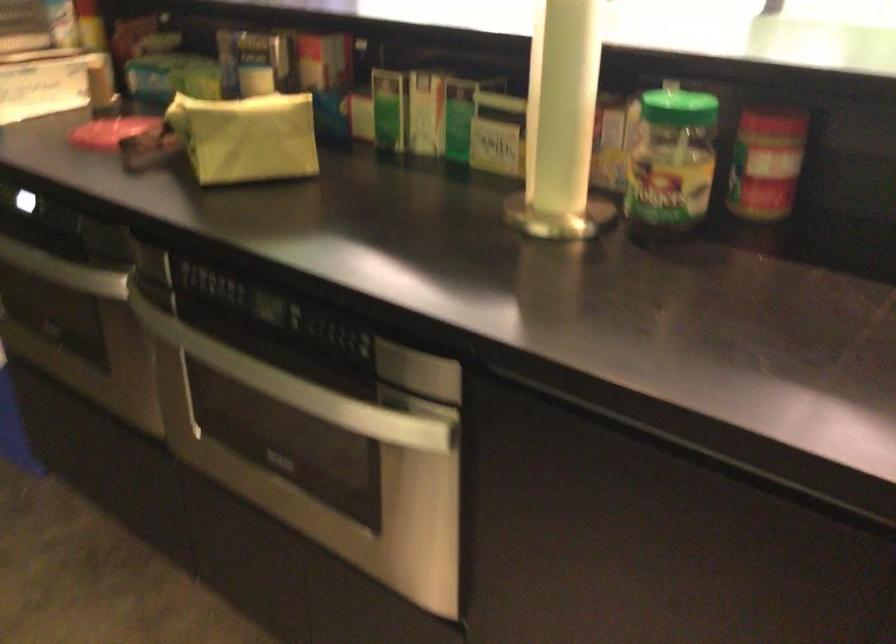
The image size is (896, 644). In order to click on green jar lid in this screenshot , I will do `click(678, 108)`.